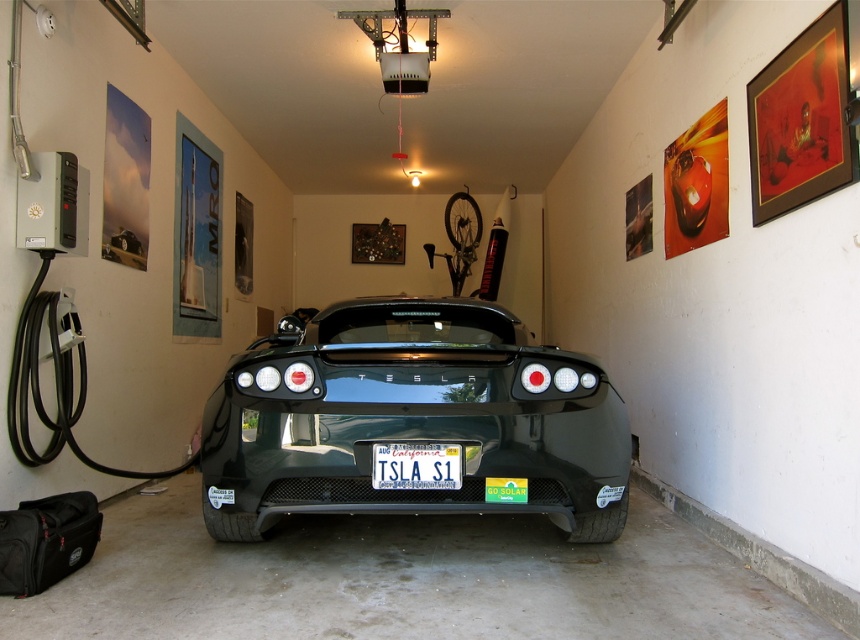
Question: Among these points, which one is farthest from the camera?

Choices:
 (A) (539, 378)
 (B) (392, 483)

Answer: (A)

Question: Among these objects, which one is farthest from the camera?

Choices:
 (A) white plastic license plate at center
 (B) shiny black tesla at center

Answer: (B)

Question: Does shiny black tesla at center have a smaller size compared to white plastic license plate at center?

Choices:
 (A) no
 (B) yes

Answer: (A)

Question: Where is shiny black tesla at center located in relation to white plastic license plate at center in the image?

Choices:
 (A) below
 (B) above

Answer: (B)

Question: Considering the relative positions of shiny black tesla at center and white plastic license plate at center in the image provided, where is shiny black tesla at center located with respect to white plastic license plate at center?

Choices:
 (A) below
 (B) above

Answer: (B)